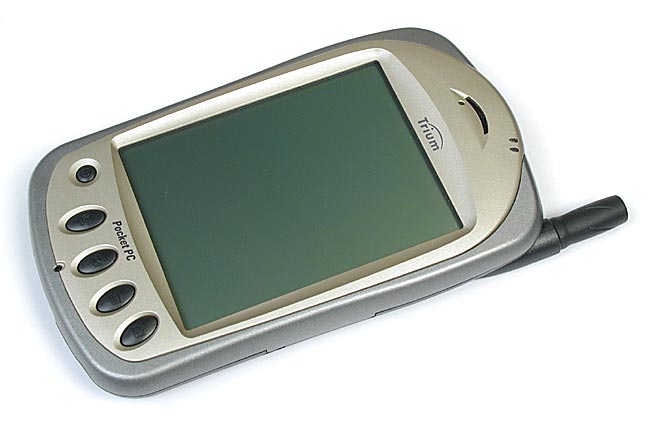
The image size is (650, 421). I want to click on lcd screen, so click(x=333, y=141).